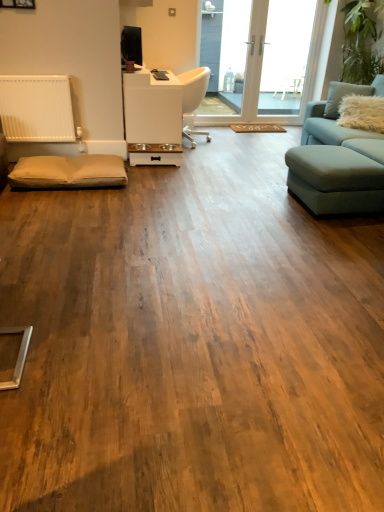
Question: Are beige fabric footrest at lower left and fuzzy white pillow at upper right far apart?

Choices:
 (A) no
 (B) yes

Answer: (B)

Question: From a real-world perspective, is beige fabric footrest at lower left positioned under fuzzy white pillow at upper right based on gravity?

Choices:
 (A) yes
 (B) no

Answer: (A)

Question: Considering the relative positions of beige fabric footrest at lower left and fuzzy white pillow at upper right in the image provided, is beige fabric footrest at lower left to the right of fuzzy white pillow at upper right from the viewer's perspective?

Choices:
 (A) yes
 (B) no

Answer: (B)

Question: Considering the relative sizes of beige fabric footrest at lower left and fuzzy white pillow at upper right in the image provided, is beige fabric footrest at lower left bigger than fuzzy white pillow at upper right?

Choices:
 (A) no
 (B) yes

Answer: (B)

Question: From a real-world perspective, is beige fabric footrest at lower left positioned over fuzzy white pillow at upper right based on gravity?

Choices:
 (A) yes
 (B) no

Answer: (B)

Question: From the image's perspective, is transparent glass door at upper center, the second window screen viewed from the right, above or below fuzzy white pillow at upper right?

Choices:
 (A) above
 (B) below

Answer: (A)

Question: Looking at their shapes, would you say transparent glass door at upper center, placed as the first window screen when sorted from left to right, is wider or thinner than fuzzy white pillow at upper right?

Choices:
 (A) thin
 (B) wide

Answer: (A)

Question: Is point (317, 44) positioned closer to the camera than point (332, 117)?

Choices:
 (A) closer
 (B) farther

Answer: (B)

Question: Based on their positions, is transparent glass door at upper center, placed as the first window screen when sorted from left to right, located to the left or right of fuzzy white pillow at upper right?

Choices:
 (A) left
 (B) right

Answer: (A)

Question: From the image's perspective, relative to light blue fabric couch at right, is fuzzy white pillow at upper right above or below?

Choices:
 (A) below
 (B) above

Answer: (B)

Question: Considering the positions of point (360, 93) and point (322, 138), is point (360, 93) closer or farther from the camera than point (322, 138)?

Choices:
 (A) farther
 (B) closer

Answer: (A)

Question: Is fuzzy white pillow at upper right taller or shorter than light blue fabric couch at right?

Choices:
 (A) tall
 (B) short

Answer: (B)

Question: Considering the positions of fuzzy white pillow at upper right and light blue fabric couch at right in the image, is fuzzy white pillow at upper right wider or thinner than light blue fabric couch at right?

Choices:
 (A) thin
 (B) wide

Answer: (A)

Question: From the image's perspective, is transparent glass door at upper center, the second window screen viewed from the right, positioned above or below white plastic chair at center?

Choices:
 (A) below
 (B) above

Answer: (B)

Question: From a real-world perspective, is transparent glass door at upper center, the second window screen viewed from the right, positioned above or below white plastic chair at center?

Choices:
 (A) above
 (B) below

Answer: (A)